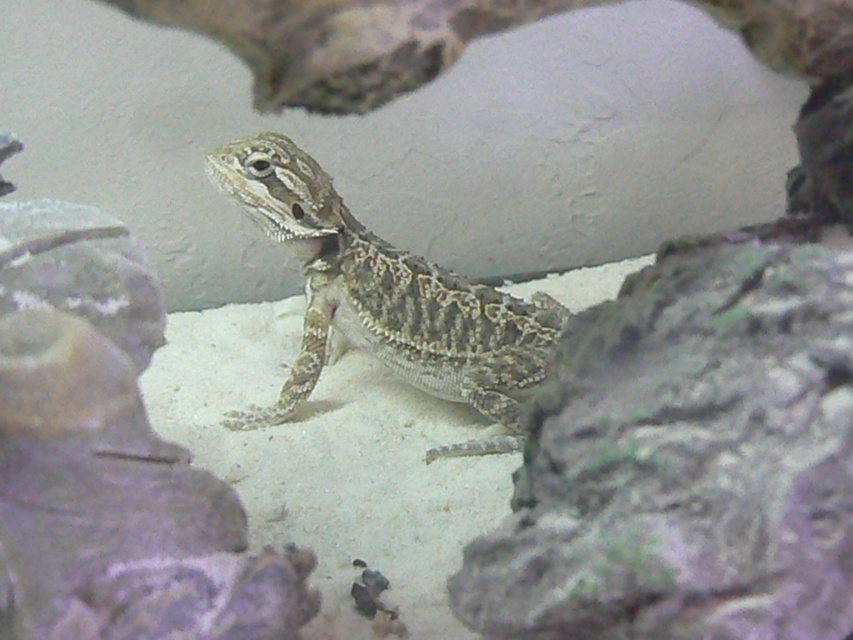
Which is more to the left, gray rough rock at lower right or camouflage-patterned lizard at center?

Positioned to the left is camouflage-patterned lizard at center.

Between gray rough rock at lower right and camouflage-patterned lizard at center, which one appears on the right side from the viewer's perspective?

Positioned to the right is gray rough rock at lower right.

Find the location of `gray rough rock at lower right`. gray rough rock at lower right is located at coordinates (688, 456).